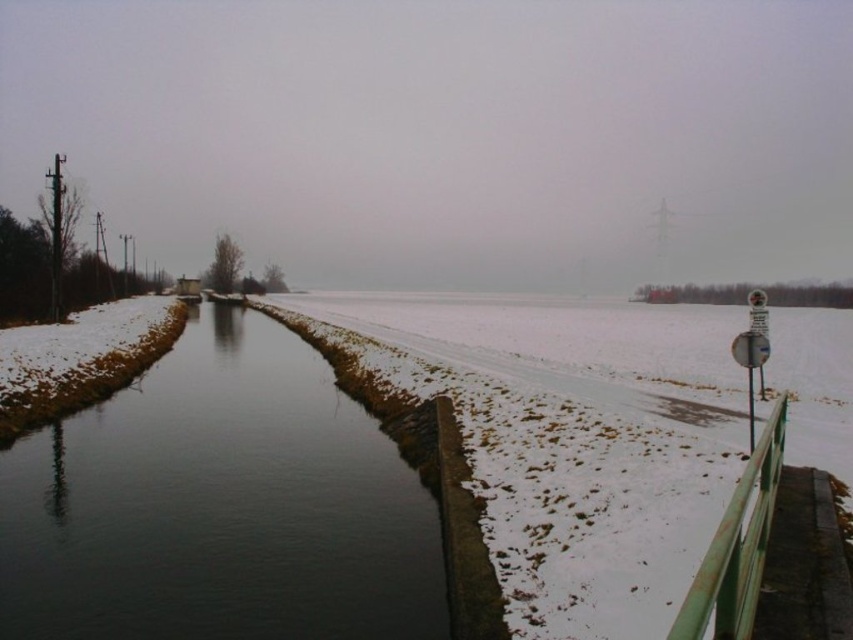
Question: Can you confirm if dark water at center is smaller than green painted metal rail at right?

Choices:
 (A) yes
 (B) no

Answer: (B)

Question: Is the position of dark water at center less distant than that of green painted metal rail at right?

Choices:
 (A) no
 (B) yes

Answer: (A)

Question: Which object appears farthest from the camera in this image?

Choices:
 (A) dark water at center
 (B) green painted metal rail at right

Answer: (A)

Question: Is dark water at center to the right of green painted metal rail at right from the viewer's perspective?

Choices:
 (A) no
 (B) yes

Answer: (A)